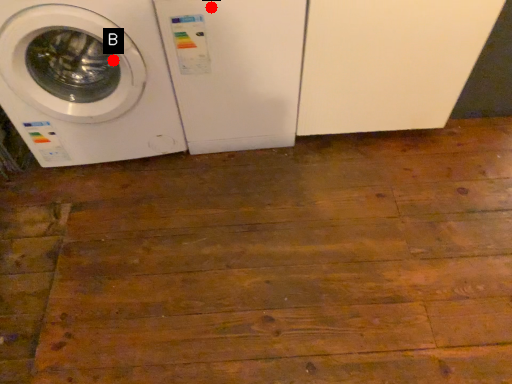
Question: Two points are circled on the image, labeled by A and B beside each circle. Which point is closer to the camera?

Choices:
 (A) A is closer
 (B) B is closer

Answer: (A)